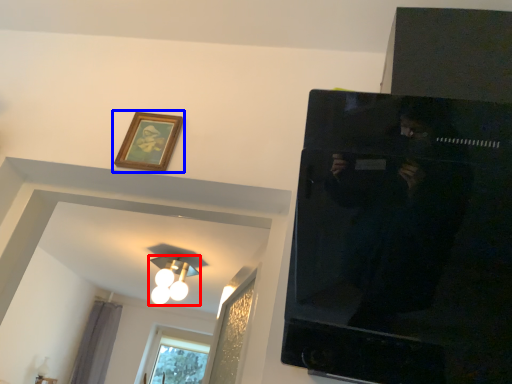
Question: Among these objects, which one is nearest to the camera, light fixture (highlighted by a red box) or picture frame (highlighted by a blue box)?

Choices:
 (A) light fixture
 (B) picture frame

Answer: (B)